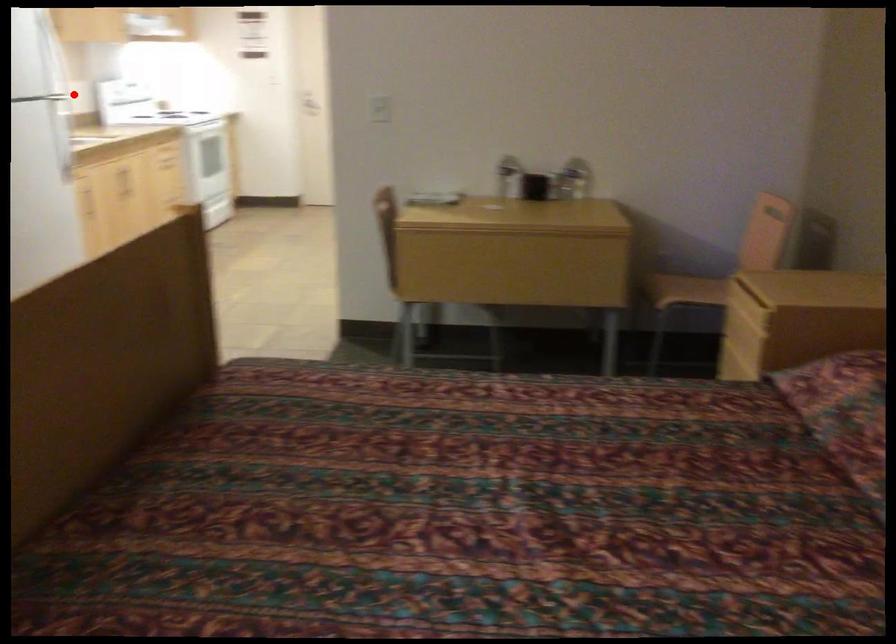
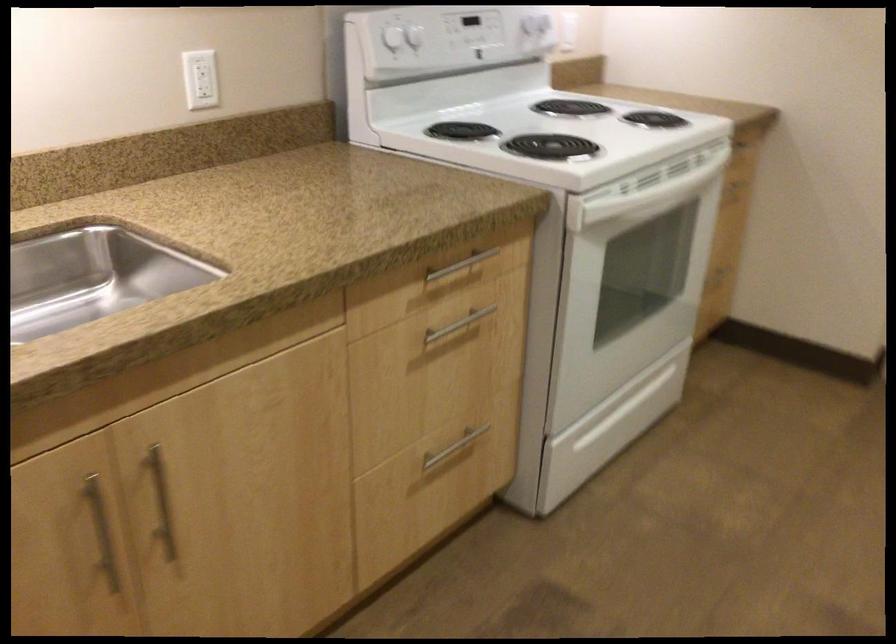
Question: I am providing you with two images of the same scene from different viewpoints. In image1, a red point is highlighted. Considering the same 3D point in image2, which of the following is correct?

Choices:
 (A) It is closer
 (B) It is farther

Answer: (A)